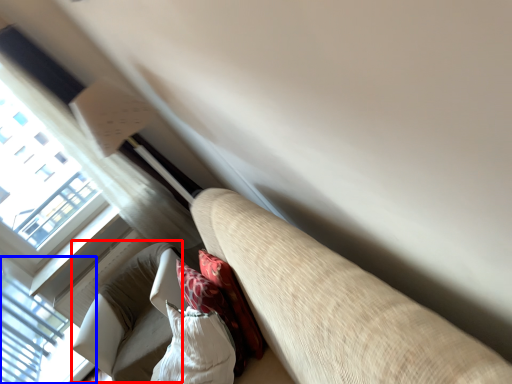
Question: Which point is further to the camera, bean bag chair (highlighted by a red box) or window (highlighted by a blue box)?

Choices:
 (A) bean bag chair
 (B) window

Answer: (B)